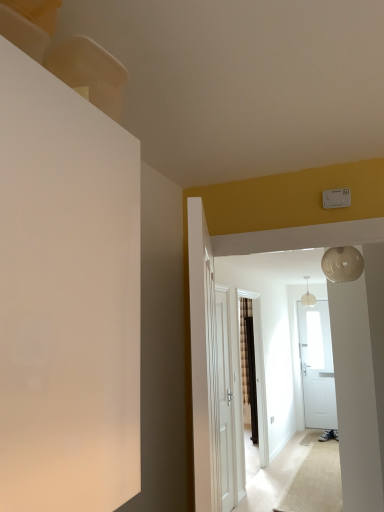
Question: Can you confirm if white wooden door at center, placed as the second door when sorted from right to left, is taller than pearl white glass globe at upper right?

Choices:
 (A) yes
 (B) no

Answer: (A)

Question: Is white wooden door at center, which ranks as the second door in back-to-front order, in front of pearl white glass globe at upper right?

Choices:
 (A) yes
 (B) no

Answer: (A)

Question: Is white wooden door at center, which ranks as the second door in back-to-front order, placed right next to pearl white glass globe at upper right?

Choices:
 (A) yes
 (B) no

Answer: (B)

Question: From the image's perspective, is white wooden door at center, the 1th door when ordered from left to right, located beneath pearl white glass globe at upper right?

Choices:
 (A) yes
 (B) no

Answer: (A)

Question: From a real-world perspective, is white wooden door at center, the 1th door when ordered from left to right, physically below pearl white glass globe at upper right?

Choices:
 (A) no
 (B) yes

Answer: (B)

Question: Choose the correct answer: Is pearl white glass globe at upper center inside white wooden door at center, marked as the 1th door in a right-to-left arrangement, or outside it?

Choices:
 (A) outside
 (B) inside

Answer: (A)

Question: Is point (311, 302) closer or farther from the camera than point (223, 386)?

Choices:
 (A) closer
 (B) farther

Answer: (B)

Question: From a real-world perspective, is pearl white glass globe at upper center physically located above or below white wooden door at center, the 2th door viewed from the front?

Choices:
 (A) above
 (B) below

Answer: (A)

Question: Looking at the image, does pearl white glass globe at upper center seem bigger or smaller compared to white wooden door at center, the 2th door viewed from the front?

Choices:
 (A) small
 (B) big

Answer: (A)

Question: Which is correct: white wooden door at center, marked as the 1th door in a right-to-left arrangement, is inside white wooden door at center, placed as the second door when sorted from right to left, or outside of it?

Choices:
 (A) inside
 (B) outside

Answer: (B)

Question: Considering the positions of white wooden door at center, the second door from the left, and white wooden door at center, which ranks as the second door in back-to-front order, in the image, is white wooden door at center, the second door from the left, taller or shorter than white wooden door at center, which ranks as the second door in back-to-front order,?

Choices:
 (A) tall
 (B) short

Answer: (A)

Question: Relative to white wooden door at center, the first door from the front, is white wooden door at center, which ranks as the 1th door in back-to-front order, in front or behind?

Choices:
 (A) behind
 (B) front

Answer: (A)

Question: From the image's perspective, is white wooden door at center, marked as the 1th door in a right-to-left arrangement, positioned above or below white wooden door at center, placed as the second door when sorted from right to left?

Choices:
 (A) above
 (B) below

Answer: (B)

Question: Considering the positions of pearl white glass globe at upper right and white wooden door at center, the 2th door viewed from the front, in the image, is pearl white glass globe at upper right wider or thinner than white wooden door at center, the 2th door viewed from the front,?

Choices:
 (A) thin
 (B) wide

Answer: (B)

Question: Is pearl white glass globe at upper right in front of or behind white wooden door at center, which ranks as the 1th door in back-to-front order, in the image?

Choices:
 (A) behind
 (B) front

Answer: (B)